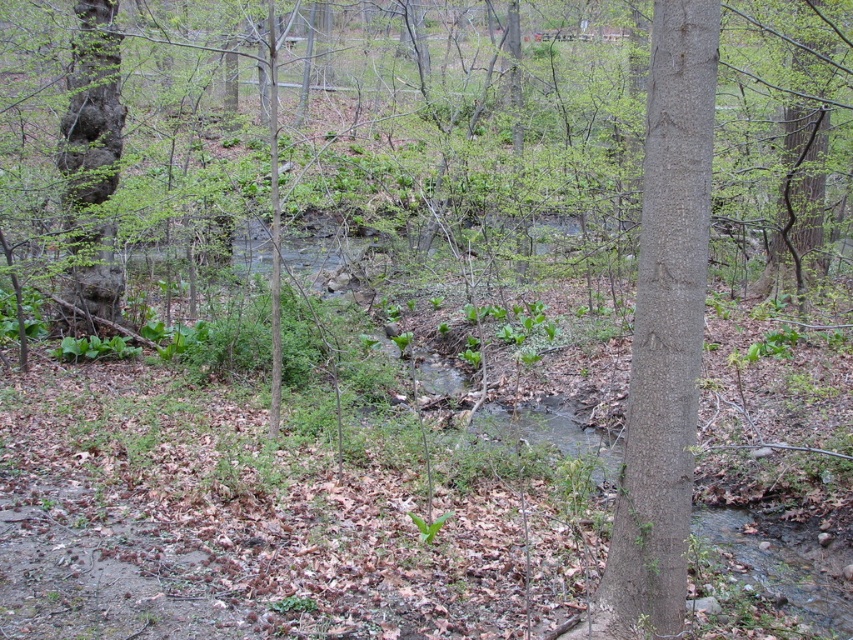
Is point (643, 532) less distant than point (97, 81)?

Yes, point (643, 532) is in front of point (97, 81).

Who is lower down, smooth brown tree trunk at center-right or dark brown bark tree at left?

smooth brown tree trunk at center-right

Looking at this image, measure the distance between point (700, 323) and camera.

They are 12.90 feet apart.

Locate an element on the screen. smooth brown tree trunk at center-right is located at coordinates (664, 333).